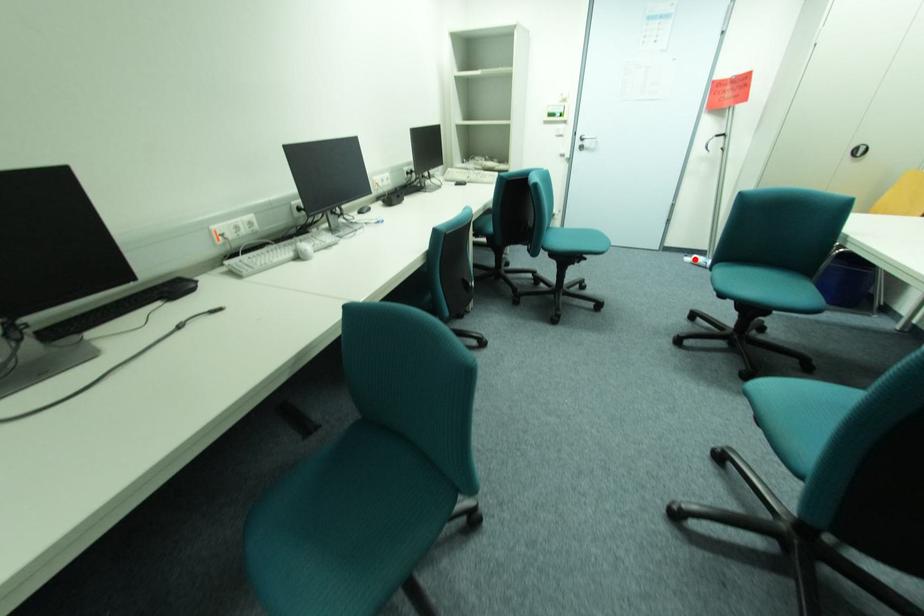
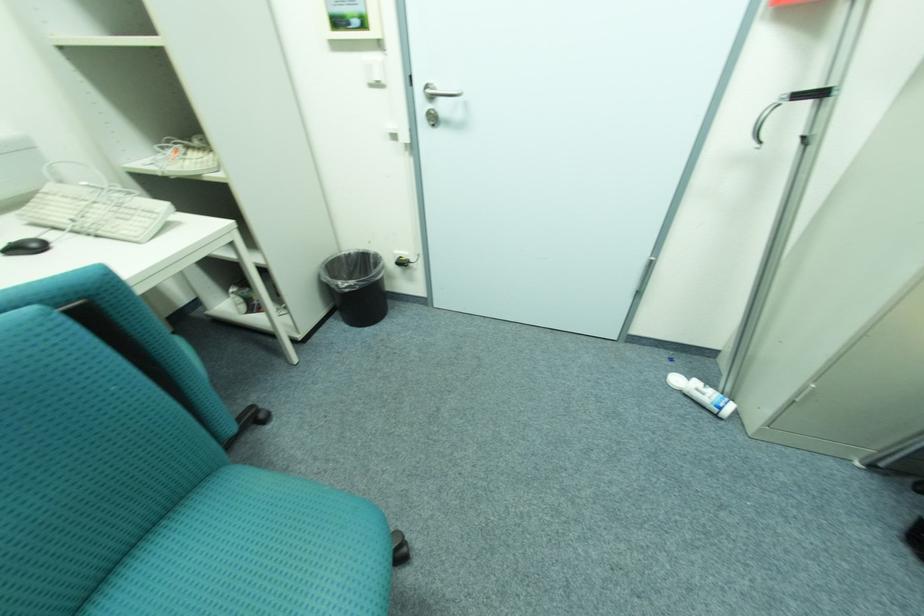
Question: I am providing you with two images of the same scene from different viewpoints. A red point is shown in image1. For the corresponding object point in image2, is it positioned nearer or farther from the camera?

Choices:
 (A) Nearer
 (B) Farther

Answer: (A)